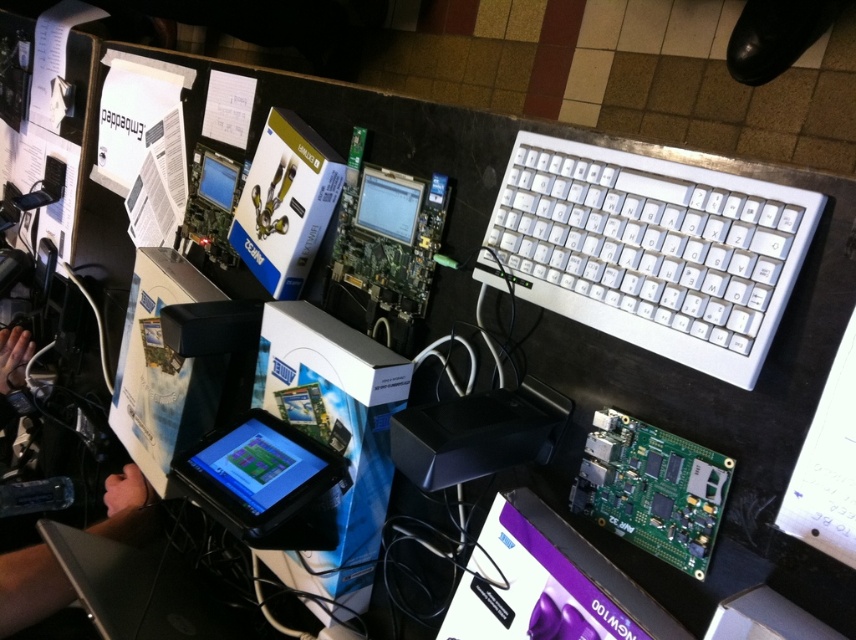
Question: Which point is closer to the camera?

Choices:
 (A) (378, 232)
 (B) (253, 486)

Answer: (B)

Question: Among these objects, which one is nearest to the camera?

Choices:
 (A) black plastic laptop at lower left
 (B) matte black monitor at center
 (C) matte black tablet at center

Answer: (C)

Question: Is white plastic keyboard at upper right positioned at the back of matte black monitor at center?

Choices:
 (A) yes
 (B) no

Answer: (B)

Question: Does white plastic keyboard at upper right lie in front of matte black screen at upper center?

Choices:
 (A) yes
 (B) no

Answer: (A)

Question: Which object is closer to the camera taking this photo?

Choices:
 (A) black plastic laptop at lower left
 (B) matte black tablet at center
 (C) matte black monitor at center
 (D) matte black screen at upper center

Answer: (B)

Question: Considering the relative positions of matte black tablet at center and matte black monitor at center in the image provided, where is matte black tablet at center located with respect to matte black monitor at center?

Choices:
 (A) above
 (B) below

Answer: (B)